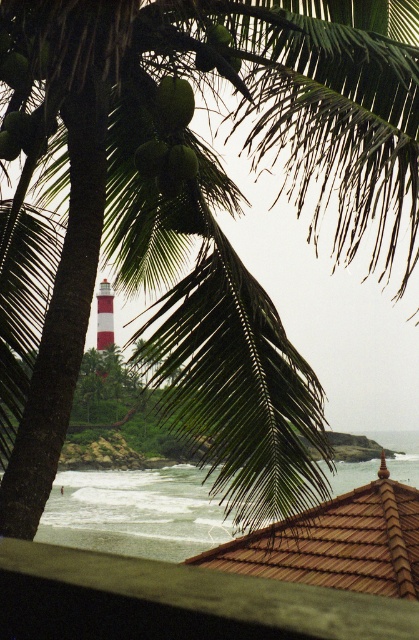
Question: Does brown tile roof at lower center appear under white striped tower at center?

Choices:
 (A) yes
 (B) no

Answer: (A)

Question: Does green matte coconut at upper center have a larger size compared to white striped tower at center?

Choices:
 (A) no
 (B) yes

Answer: (A)

Question: Which of the following is the closest to the observer?

Choices:
 (A) green matte coconut at center
 (B) white striped tower at center
 (C) green matte coconut at upper center
 (D) brown tile roof at lower center

Answer: (C)

Question: Which is farther from the green matte coconut at center?

Choices:
 (A) brown tile roof at lower center
 (B) white striped tower at center

Answer: (B)

Question: From the image, what is the correct spatial relationship of brown tile roof at lower center in relation to white striped tower at center?

Choices:
 (A) below
 (B) above

Answer: (A)

Question: Which object is farther from the camera taking this photo?

Choices:
 (A) green matte coconut at center
 (B) green matte coconut at upper center
 (C) brown tile roof at lower center
 (D) white striped tower at center

Answer: (D)